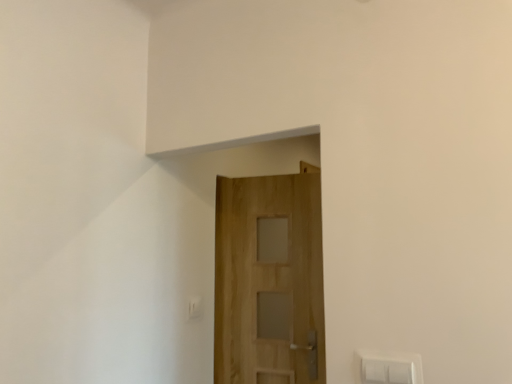
Question: Is white plastic light switch at lower center not within natural wood door at center?

Choices:
 (A) no
 (B) yes

Answer: (B)

Question: Is natural wood door at center at the back of white plastic light switch at lower center?

Choices:
 (A) no
 (B) yes

Answer: (A)

Question: Could natural wood door at center be considered to be inside white plastic light switch at lower center?

Choices:
 (A) yes
 (B) no

Answer: (B)

Question: From the image's perspective, is white plastic light switch at lower center over natural wood door at center?

Choices:
 (A) no
 (B) yes

Answer: (A)

Question: Is white plastic light switch at lower center thinner than natural wood door at center?

Choices:
 (A) yes
 (B) no

Answer: (A)

Question: Does white plastic light switch at lower center appear on the right side of natural wood door at center?

Choices:
 (A) no
 (B) yes

Answer: (A)

Question: From the image's perspective, is natural wood door at center located beneath white plastic light switch at lower center?

Choices:
 (A) yes
 (B) no

Answer: (B)

Question: Can you confirm if natural wood door at center is positioned to the right of white plastic light switch at lower center?

Choices:
 (A) yes
 (B) no

Answer: (A)

Question: Is natural wood door at center in front of white plastic light switch at lower center?

Choices:
 (A) no
 (B) yes

Answer: (B)

Question: Is natural wood door at center at the left side of white plastic light switch at lower center?

Choices:
 (A) no
 (B) yes

Answer: (A)

Question: Is natural wood door at center wider than white plastic light switch at lower center?

Choices:
 (A) yes
 (B) no

Answer: (A)

Question: Does natural wood door at center have a lesser height compared to white plastic light switch at lower center?

Choices:
 (A) yes
 (B) no

Answer: (B)

Question: Does point (234, 365) appear closer or farther from the camera than point (192, 309)?

Choices:
 (A) closer
 (B) farther

Answer: (B)